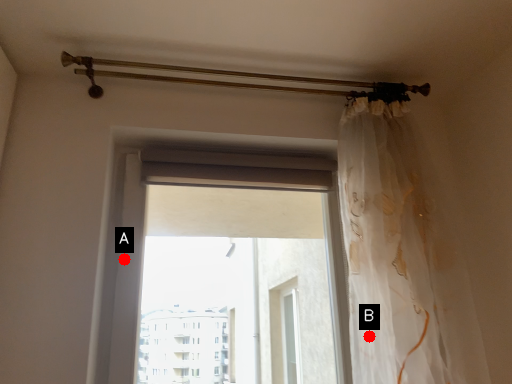
Question: Two points are circled on the image, labeled by A and B beside each circle. Which point is farther to the camera?

Choices:
 (A) A is further
 (B) B is further

Answer: (A)